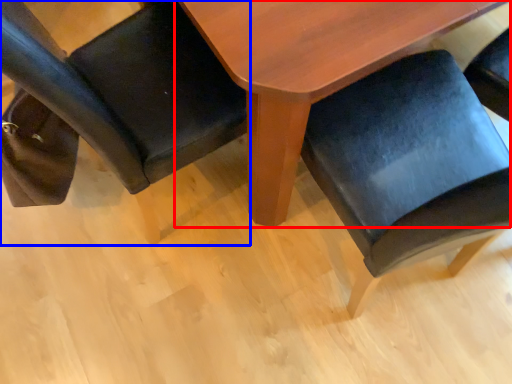
Question: Which object is further to the camera taking this photo, table (highlighted by a red box) or chair (highlighted by a blue box)?

Choices:
 (A) table
 (B) chair

Answer: (A)